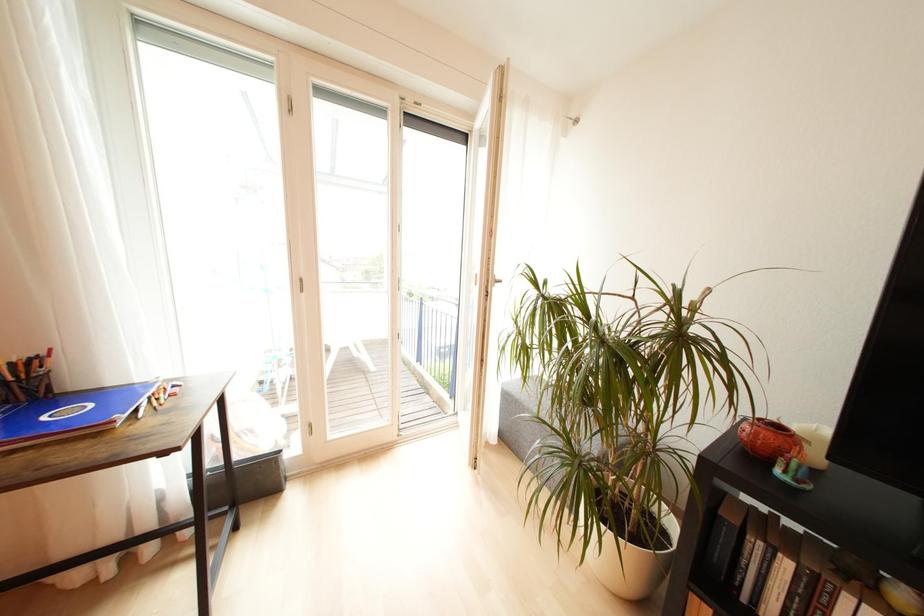
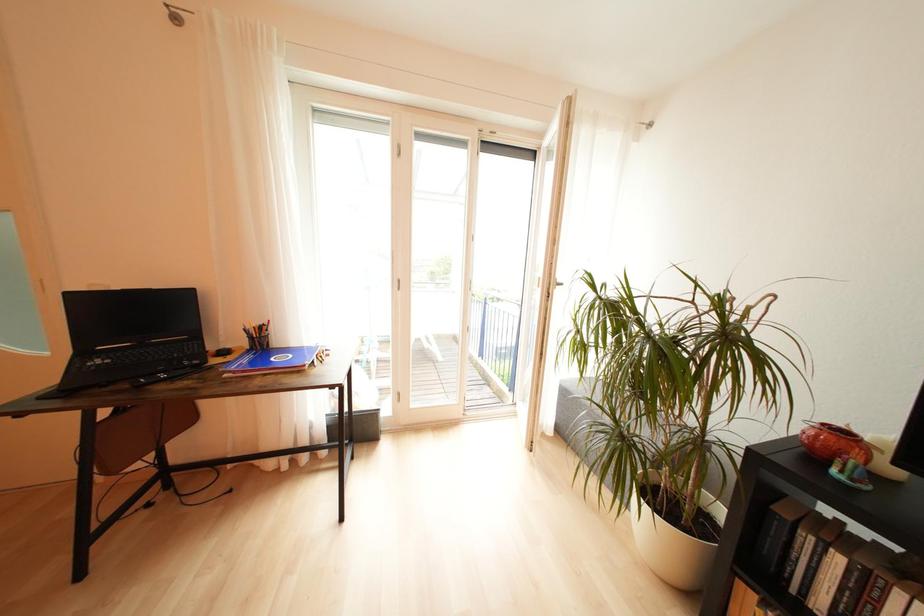
Question: The images are taken continuously from a first-person perspective. In which direction are you moving?

Choices:
 (A) Left
 (B) Right
 (C) Forward
 (D) Backward

Answer: (D)